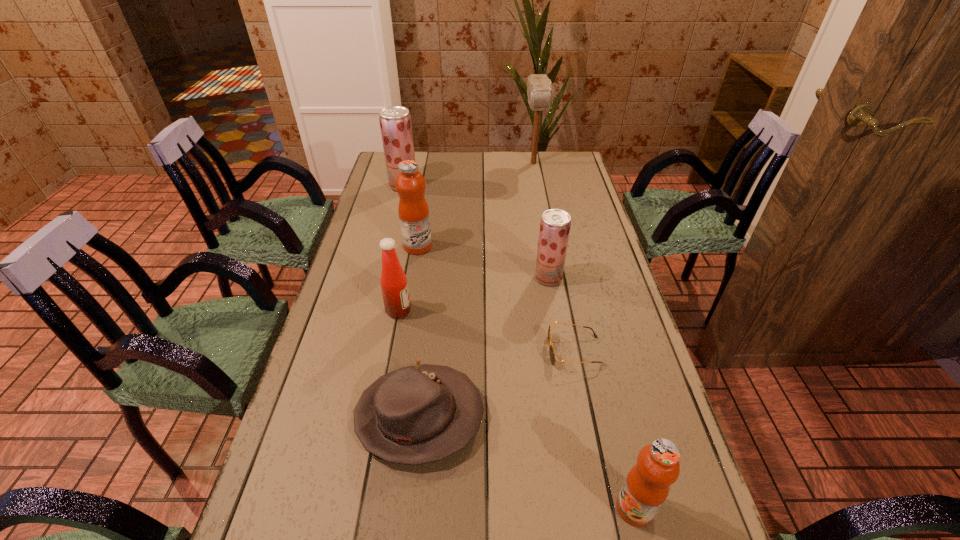
Image resolution: width=960 pixels, height=540 pixels. I want to click on hat situated at the left edge, so click(x=419, y=414).

I want to click on mallet that is at the right edge, so click(539, 87).

The image size is (960, 540). I want to click on fruit juice that is at the right edge, so click(646, 487).

I want to click on sunglasses that is at the right edge, so click(551, 349).

Where is `object situated at the far left corner`? Image resolution: width=960 pixels, height=540 pixels. object situated at the far left corner is located at coordinates (395, 121).

I want to click on object situated at the far right corner, so click(539, 87).

Locate an element on the screen. The image size is (960, 540). vacant space at the far edge is located at coordinates tap(538, 179).

At what (x,y) coordinates should I click in order to perform the action: click on vacant area at the left edge of the desktop. Please return your answer as a coordinate pair (x, y). The height and width of the screenshot is (540, 960). Looking at the image, I should click on (364, 372).

Image resolution: width=960 pixels, height=540 pixels. In the image, there is a desktop. What are the coordinates of `vacant space at the right edge` in the screenshot? It's located at (649, 361).

At what (x,y) coordinates should I click in order to perform the action: click on free point between the seventh tallest object and the farther strawberry fruit juice. Please return your answer as a coordinate pair (x, y). The image size is (960, 540). Looking at the image, I should click on (412, 301).